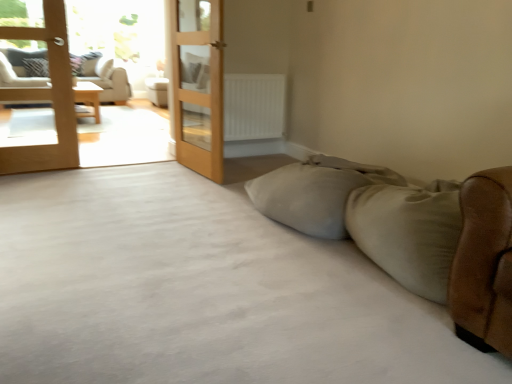
Question: Is matte white couch at left, arranged as the first studio couch when viewed from the back, completely or partially outside of light brown wooden terrace at left?

Choices:
 (A) yes
 (B) no

Answer: (A)

Question: From a real-world perspective, is matte white couch at left, the second studio couch when ordered from front to back, on light brown wooden terrace at left?

Choices:
 (A) yes
 (B) no

Answer: (B)

Question: Considering the relative sizes of matte white couch at left, arranged as the first studio couch when viewed from the back, and light brown wooden terrace at left in the image provided, is matte white couch at left, arranged as the first studio couch when viewed from the back, taller than light brown wooden terrace at left?

Choices:
 (A) no
 (B) yes

Answer: (A)

Question: From the image's perspective, is matte white couch at left, which appears as the second studio couch when viewed from the right, under light brown wooden terrace at left?

Choices:
 (A) yes
 (B) no

Answer: (B)

Question: Can you confirm if matte white couch at left, the second studio couch when ordered from front to back, is wider than light brown wooden terrace at left?

Choices:
 (A) yes
 (B) no

Answer: (A)

Question: Is matte white couch at left, the 1th studio couch positioned from the left, shorter than light brown wooden terrace at left?

Choices:
 (A) no
 (B) yes

Answer: (B)

Question: From a real-world perspective, does light brown wooden door at center, the first door when ordered from right to left, stand above light brown wooden terrace at left?

Choices:
 (A) no
 (B) yes

Answer: (B)

Question: Considering the relative sizes of light brown wooden door at center, the second door positioned from the left, and light brown wooden terrace at left in the image provided, is light brown wooden door at center, the second door positioned from the left, bigger than light brown wooden terrace at left?

Choices:
 (A) no
 (B) yes

Answer: (A)

Question: Considering the relative sizes of light brown wooden door at center, the first door when ordered from right to left, and light brown wooden terrace at left in the image provided, is light brown wooden door at center, the first door when ordered from right to left, smaller than light brown wooden terrace at left?

Choices:
 (A) yes
 (B) no

Answer: (A)

Question: From a real-world perspective, is light brown wooden door at center, the second door positioned from the left, beneath light brown wooden terrace at left?

Choices:
 (A) yes
 (B) no

Answer: (B)

Question: Is light brown wooden door at center, the second door positioned from the left, positioned with its back to light brown wooden terrace at left?

Choices:
 (A) no
 (B) yes

Answer: (A)

Question: Considering the relative sizes of light brown wooden door at center, the first door when ordered from right to left, and light brown wooden terrace at left in the image provided, is light brown wooden door at center, the first door when ordered from right to left, shorter than light brown wooden terrace at left?

Choices:
 (A) yes
 (B) no

Answer: (A)

Question: From the image's perspective, would you say wooden table at left is shown under white matte radiator at center?

Choices:
 (A) no
 (B) yes

Answer: (A)